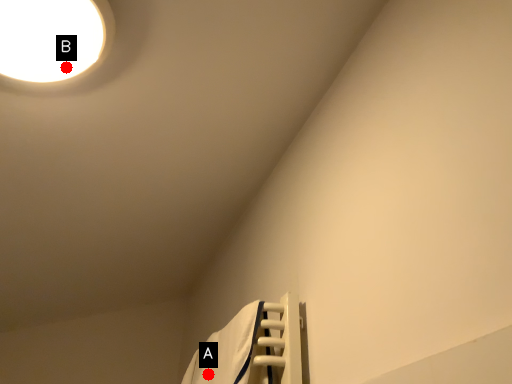
Question: Two points are circled on the image, labeled by A and B beside each circle. Which point is closer to the camera?

Choices:
 (A) A is closer
 (B) B is closer

Answer: (B)